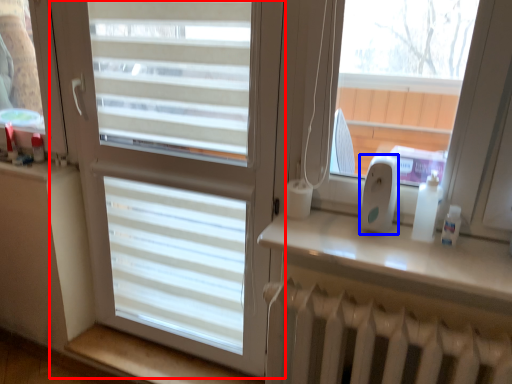
Question: Among these objects, which one is farthest to the camera, window (highlighted by a red box) or ipod (highlighted by a blue box)?

Choices:
 (A) window
 (B) ipod

Answer: (A)